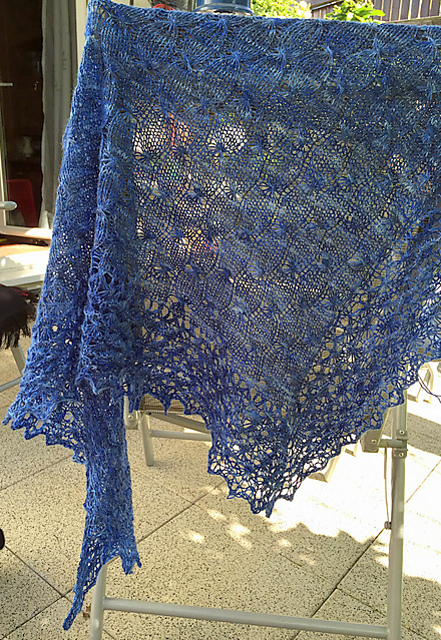
Locate an element on the screen. This screenshot has height=640, width=441. rack is located at coordinates (395, 557).